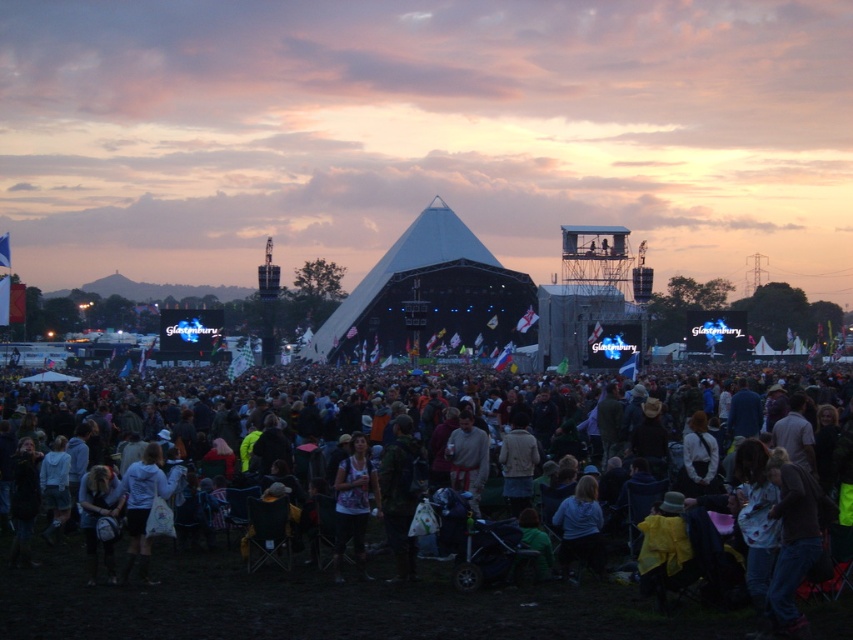
Looking at this image, you are standing at the camera position and want to reach the point at coordinates (660, 492). If you walk straight ahead, will you reach that point?

Yes, because the point at coordinates (660, 492) is directly in front of the camera at a distance of 774.05 feet.

You are a photographer at the Glastonbury Festival. You want to capture a photo of the crowd while focusing on the dark casual clothing at center and the printed fabric shirt at center. Which of these two items should you pan your camera to the left to include in the frame?

You should pan your camera to the left to include the printed fabric shirt at center because the dark casual clothing at center is to the right of it.